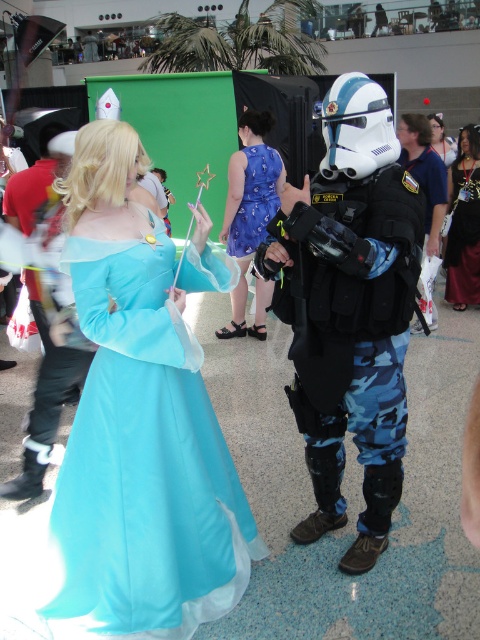
You are a photographer at the event and need to position the matte blue costume at center and the matte black hair at upper center in your shot. Based on their sizes, which object should you focus on to ensure both fit in the frame?

The matte blue costume at center is smaller than the matte black hair at upper center, so you should focus on the matte black hair at upper center to ensure both fit in the frame.

Please look at the image and locate the point at coordinates (x=251, y=216). Which object from the scene does this point correspond to?

The point at coordinates (x=251, y=216) corresponds to the blue satin dress at center.

You are attending a costume event and notice two key elements in the scene. There is a blue satin dress at center and a matte black hair at upper center. From your perspective, which of these two elements is positioned to the left?

The blue satin dress at center is to the left of the matte black hair at upper center, so the blue satin dress at center is positioned to the left.